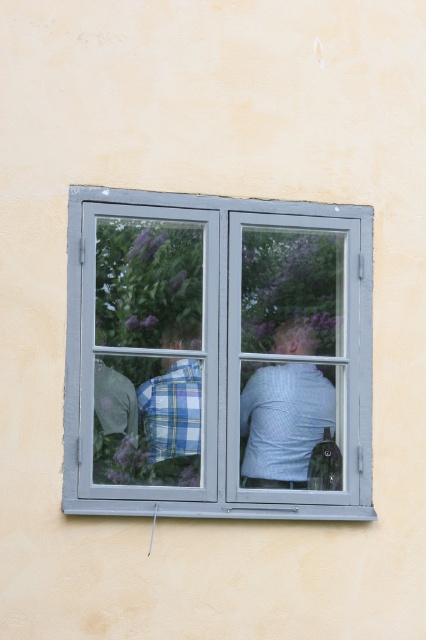
Question: Among these objects, which one is farthest from the camera?

Choices:
 (A) plaid shirt at center
 (B) blue plaid shirt at center
 (C) light blue checkered shirt at center

Answer: (C)

Question: Which of the following is the closest to the observer?

Choices:
 (A) (181, 385)
 (B) (287, 477)
 (C) (284, 444)
 (D) (356, 484)

Answer: (A)

Question: Does blue plaid shirt at center appear over light blue checkered shirt at center?

Choices:
 (A) no
 (B) yes

Answer: (A)

Question: Observing the image, what is the correct spatial positioning of light blue checkered shirt at center in reference to plaid shirt at center?

Choices:
 (A) right
 (B) left

Answer: (A)

Question: Is blue plaid shirt at center closer to camera compared to plaid shirt at center?

Choices:
 (A) yes
 (B) no

Answer: (A)

Question: Considering the real-world distances, which object is closest to the plaid shirt at center?

Choices:
 (A) blue plaid shirt at center
 (B) light blue checkered shirt at center
 (C) gray metallic window at center

Answer: (A)